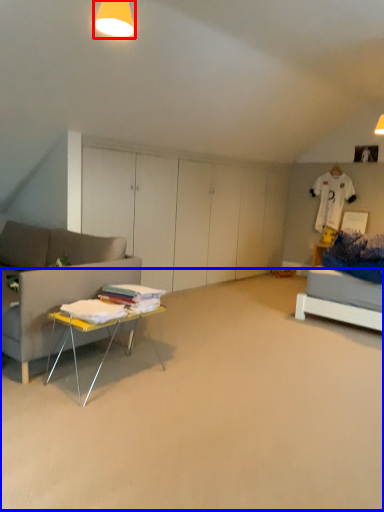
Question: Which of the following is the closest to the observer, lighting (highlighted by a red box) or plain (highlighted by a blue box)?

Choices:
 (A) lighting
 (B) plain

Answer: (B)